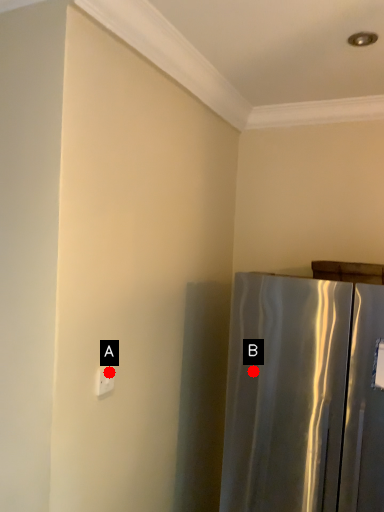
Question: Two points are circled on the image, labeled by A and B beside each circle. Which point is closer to the camera?

Choices:
 (A) A is closer
 (B) B is closer

Answer: (A)